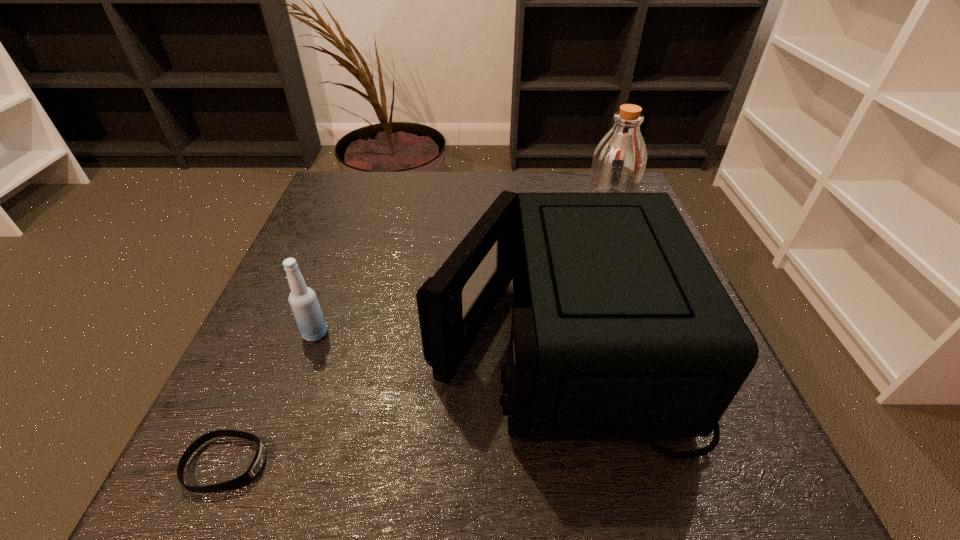
Where is `free spot located 0.320m on the right of the left bottle`? This screenshot has height=540, width=960. free spot located 0.320m on the right of the left bottle is located at coordinates (507, 333).

At what (x,y) coordinates should I click in order to perform the action: click on free space located on the display of the wristband. Please return your answer as a coordinate pair (x, y). Image resolution: width=960 pixels, height=540 pixels. Looking at the image, I should click on (444, 464).

You are a GUI agent. You are given a task and a screenshot of the screen. Output one action in this format:
    pyautogui.click(x=<x>, y=<y>)
    Task: Click on the object that is positioned at the far edge
    This screenshot has width=960, height=540.
    Given the screenshot: What is the action you would take?
    pyautogui.click(x=619, y=160)

Find the location of a particular element. Image resolution: width=960 pixels, height=540 pixels. microwave oven that is at the near edge is located at coordinates (621, 328).

You are a GUI agent. You are given a task and a screenshot of the screen. Output one action in this format:
    pyautogui.click(x=<x>, y=<y>)
    Task: Click on the wristband at the near edge
    This screenshot has height=540, width=960.
    Given the screenshot: What is the action you would take?
    pyautogui.click(x=250, y=474)

Where is `bottle present at the left edge`? Image resolution: width=960 pixels, height=540 pixels. bottle present at the left edge is located at coordinates (303, 301).

Identify the location of wristband positioned at the left edge. This screenshot has height=540, width=960. (250, 474).

Image resolution: width=960 pixels, height=540 pixels. I want to click on bottle that is at the right edge, so click(x=619, y=160).

In order to click on microwave oven located in the right edge section of the desktop in this screenshot , I will do `click(621, 328)`.

The image size is (960, 540). Find the location of `object present at the near left corner`. object present at the near left corner is located at coordinates (250, 474).